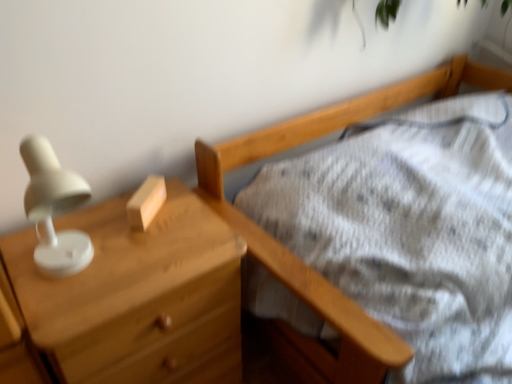
What is the approximate width of matte wood chest of drawers at left?

The width of matte wood chest of drawers at left is 16.26 inches.

Find the location of `matte wood chest of drawers at left`. matte wood chest of drawers at left is located at coordinates pyautogui.click(x=138, y=296).

The width and height of the screenshot is (512, 384). Describe the element at coordinates (138, 296) in the screenshot. I see `matte wood chest of drawers at left` at that location.

This screenshot has height=384, width=512. What do you see at coordinates (146, 202) in the screenshot?
I see `wooden block at center` at bounding box center [146, 202].

In order to face wooden block at center, should I rotate leftwards or rightwards?

It's best to rotate left around 14.548 degrees.

At what (x,y) coordinates should I click in order to perform the action: click on wooden block at center. Please return your answer as a coordinate pair (x, y). This screenshot has width=512, height=384. Looking at the image, I should click on (146, 202).

Where is `matte wood chest of drawers at left`? matte wood chest of drawers at left is located at coordinates (138, 296).

Can you confirm if matte wood chest of drawers at left is positioned to the left of wooden block at center?

Yes.

Is the depth of matte wood chest of drawers at left less than that of wooden block at center?

Yes, it is.

Considering the points (121, 334) and (134, 209), which point is behind, point (121, 334) or point (134, 209)?

The point (134, 209) is farther from the camera.

From the image's perspective, which one is positioned lower, matte wood chest of drawers at left or wooden block at center?

matte wood chest of drawers at left.

From a real-world perspective, does matte wood chest of drawers at left stand above wooden block at center?

No.

Looking at their sizes, would you say matte wood chest of drawers at left is wider or thinner than wooden block at center?

matte wood chest of drawers at left is wider than wooden block at center.

Is matte wood chest of drawers at left taller or shorter than wooden block at center?

In the image, matte wood chest of drawers at left appears to be taller than wooden block at center.

Between matte wood chest of drawers at left and wooden block at center, which one has smaller size?

Smaller between the two is wooden block at center.

Would you say matte wood chest of drawers at left is inside or outside wooden block at center?

matte wood chest of drawers at left is spatially situated outside wooden block at center.

Is matte wood chest of drawers at left next to wooden block at center and touching it?

No.

Is matte wood chest of drawers at left oriented away from wooden block at center?

No, wooden block at center is not at the back of matte wood chest of drawers at left.

Can you tell me how much matte wood chest of drawers at left and wooden block at center differ in facing direction?

37.2 degrees.

Identify the location of block above the matte wood chest of drawers at left (from a real-world perspective). (146, 202).

Which is more to the right, wooden block at center or matte wood chest of drawers at left?

wooden block at center.

Considering the relative positions of wooden block at center and matte wood chest of drawers at left in the image provided, is wooden block at center in front of matte wood chest of drawers at left?

That is False.

Considering the positions of point (143, 217) and point (145, 242), is point (143, 217) closer or farther from the camera than point (145, 242)?

Clearly, point (143, 217) is more distant from the camera than point (145, 242).

From the image's perspective, is wooden block at center located above or below matte wood chest of drawers at left?

Based on their image positions, wooden block at center is located above matte wood chest of drawers at left.

From a real-world perspective, which object stands above the other?

wooden block at center, from a real-world perspective.

Between wooden block at center and matte wood chest of drawers at left, which one has smaller width?

wooden block at center is thinner.

In the scene shown: Considering the relative sizes of wooden block at center and matte wood chest of drawers at left in the image provided, is wooden block at center shorter than matte wood chest of drawers at left?

Indeed, wooden block at center has a lesser height compared to matte wood chest of drawers at left.

In terms of size, does wooden block at center appear bigger or smaller than matte wood chest of drawers at left?

Considering their sizes, wooden block at center takes up less space than matte wood chest of drawers at left.

Is matte wood chest of drawers at left located within wooden block at center?

No, matte wood chest of drawers at left is not surrounded by wooden block at center.

Consider the image. Is wooden block at center not close to matte wood chest of drawers at left?

No, there isn't a large distance between wooden block at center and matte wood chest of drawers at left.

Is wooden block at center oriented towards matte wood chest of drawers at left?

No, wooden block at center is not aimed at matte wood chest of drawers at left.

In the image, there is a matte wood chest of drawers at left. Where is `block above it (from the image's perspective)`? The height and width of the screenshot is (384, 512). block above it (from the image's perspective) is located at coordinates (146, 202).

I want to click on chest of drawers that appears on the left of wooden block at center, so click(138, 296).

I want to click on block on the right of the matte wood chest of drawers at left, so click(146, 202).